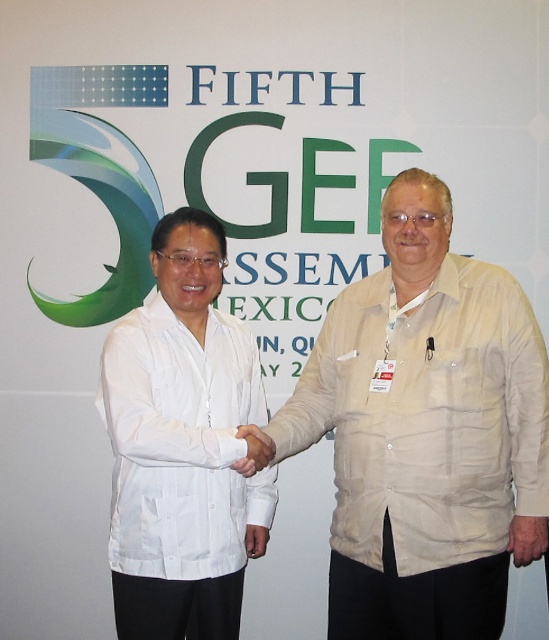
Looking at this image, can you confirm if beige fabric shirt at center is bigger than white matte shirt at center?

Correct, beige fabric shirt at center is larger in size than white matte shirt at center.

This screenshot has height=640, width=549. Describe the element at coordinates (425, 432) in the screenshot. I see `beige fabric shirt at center` at that location.

You are a GUI agent. You are given a task and a screenshot of the screen. Output one action in this format:
    pyautogui.click(x=<x>, y=<y>)
    Task: Click on the beige fabric shirt at center
    
    Given the screenshot: What is the action you would take?
    pyautogui.click(x=425, y=432)